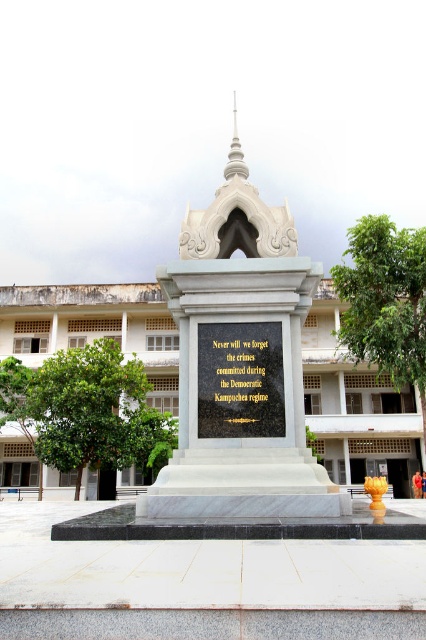
You are standing at the entrance of the public square and want to locate the white marble monument at center. According to the coordinates provided, where should you look relative to your current position?

The white marble monument at center is located at coordinates point (241, 364), which is slightly to the right and above your current position at the entrance.